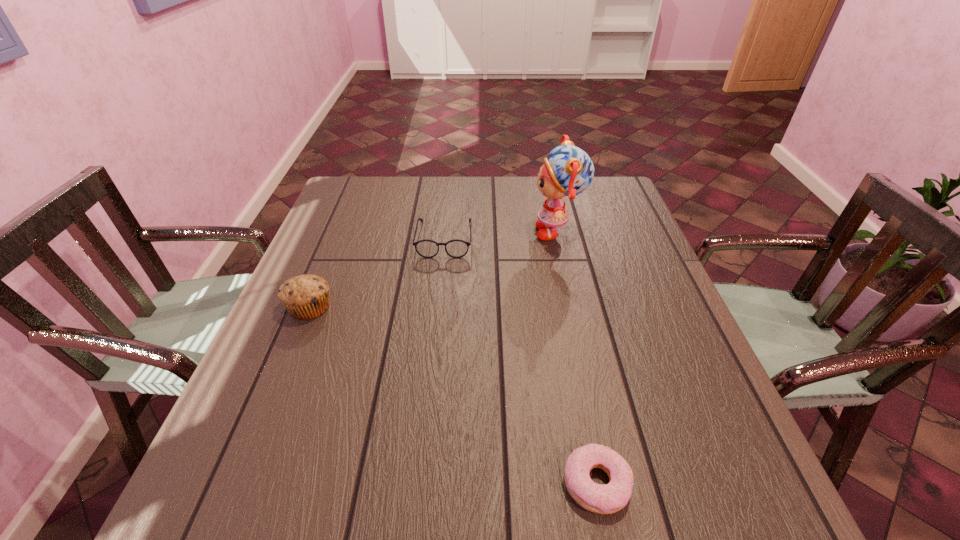
Identify the location of vacant space at the far left corner. The image size is (960, 540). (334, 206).

Locate an element on the screen. The height and width of the screenshot is (540, 960). free space at the far right corner of the desktop is located at coordinates (599, 193).

This screenshot has width=960, height=540. I want to click on vacant space that is in between the shortest object and the doll, so click(x=577, y=357).

This screenshot has height=540, width=960. What are the coordinates of `free spot between the second tallest object and the shortest object` in the screenshot? It's located at (453, 395).

This screenshot has height=540, width=960. What are the coordinates of `free space between the second object from left to right and the shortest object` in the screenshot? It's located at (520, 361).

Find the location of `empty space between the spectacles and the second nearest object`. empty space between the spectacles and the second nearest object is located at coordinates (377, 273).

The width and height of the screenshot is (960, 540). Identify the location of free space between the second object from left to right and the second tallest object. (377, 273).

This screenshot has width=960, height=540. Identify the location of free spot between the muffin and the nearest object. (453, 395).

You are a GUI agent. You are given a task and a screenshot of the screen. Output one action in this format:
    pyautogui.click(x=<x>, y=<y>)
    Task: Click on the vacant space that's between the second nearest object and the tallest object
    This screenshot has height=540, width=960.
    Given the screenshot: What is the action you would take?
    (434, 269)

Image resolution: width=960 pixels, height=540 pixels. What are the coordinates of `vacant space in between the tallest object and the third tallest object` in the screenshot? It's located at (501, 235).